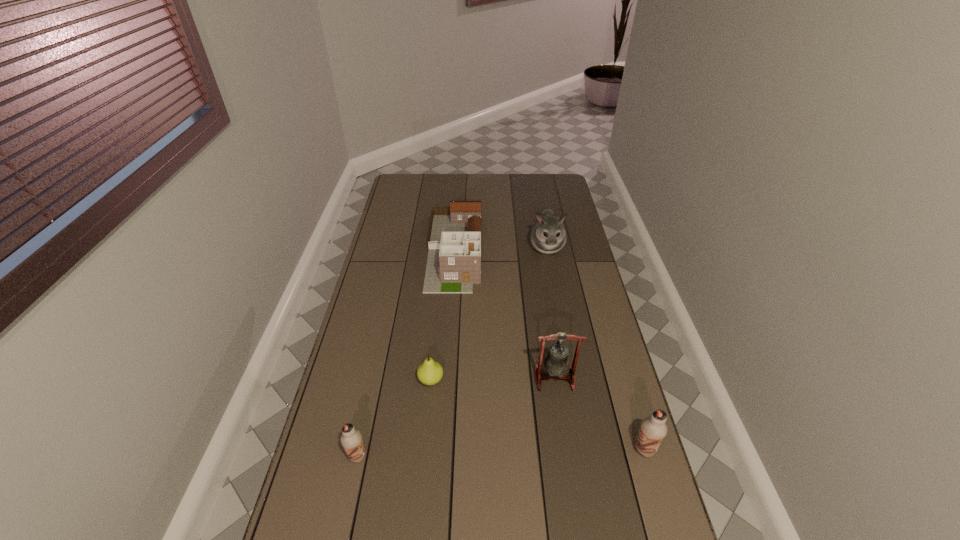
Where is `vacant area at the left edge`? vacant area at the left edge is located at coordinates (388, 332).

Identify the location of free space at the right edge of the desktop. Image resolution: width=960 pixels, height=540 pixels. (643, 465).

I want to click on vacant space at the far right corner of the desktop, so pyautogui.click(x=539, y=197).

Identify the location of free space between the rightmost object and the hamster. (595, 348).

I want to click on vacant space that is in between the shorter chocolate milk and the rightmost object, so click(x=501, y=453).

Where is `vacant area that lies between the shorter chocolate milk and the dollhouse`? Image resolution: width=960 pixels, height=540 pixels. vacant area that lies between the shorter chocolate milk and the dollhouse is located at coordinates (406, 353).

Identify the location of unoccupied position between the dollhouse and the pear. The height and width of the screenshot is (540, 960). (444, 315).

The height and width of the screenshot is (540, 960). In order to click on empty location between the pear and the dollhouse in this screenshot , I will do `click(444, 315)`.

This screenshot has height=540, width=960. What are the coordinates of `empty space that is in between the pear and the bell` in the screenshot? It's located at 492,379.

In order to click on free spot between the bell and the hamster in this screenshot , I will do `click(551, 313)`.